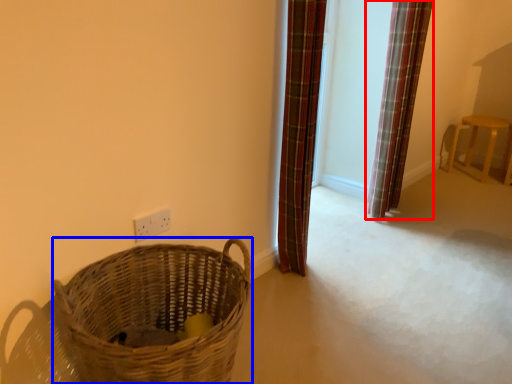
Question: Which object appears closest to the camera in this image, curtain (highlighted by a red box) or basket (highlighted by a blue box)?

Choices:
 (A) curtain
 (B) basket

Answer: (B)